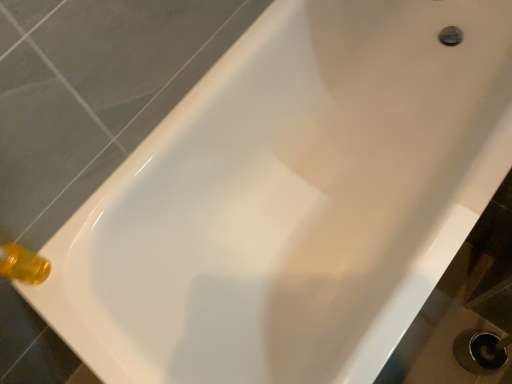
This screenshot has height=384, width=512. In order to click on vacant area to the right of translucent yellow liquid at lower left in this screenshot , I will do `click(75, 244)`.